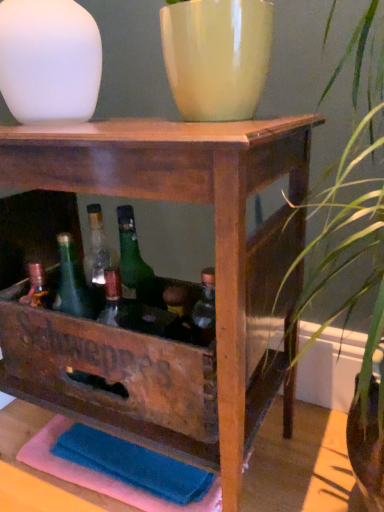
Question: Do you think matte yellow vase at upper center is within white matte vase at upper left, or outside of it?

Choices:
 (A) inside
 (B) outside

Answer: (B)

Question: Is matte yellow vase at upper center taller or shorter than white matte vase at upper left?

Choices:
 (A) short
 (B) tall

Answer: (A)

Question: Estimate the real-world distances between objects in this image. Which object is farther from the wooden crate at center?

Choices:
 (A) matte yellow vase at upper center
 (B) white matte vase at upper left
 (C) matte green glass bottle at center

Answer: (B)

Question: Estimate the real-world distances between objects in this image. Which object is closer to the wooden crate at center?

Choices:
 (A) matte yellow vase at upper center
 (B) matte green glass bottle at center
 (C) white matte vase at upper left

Answer: (B)